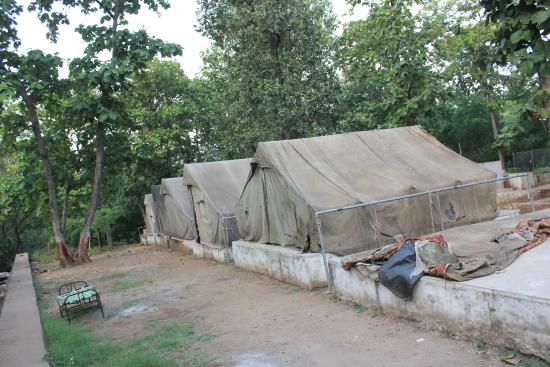
Locate an element on the screen. This screenshot has width=550, height=367. blanket is located at coordinates (88, 293).